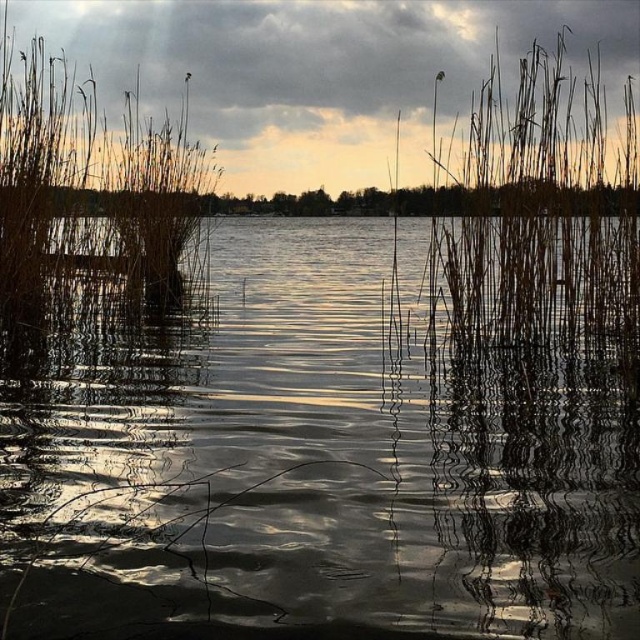
Identify the location of glistening water at center. (316, 464).

This screenshot has width=640, height=640. Find the location of `glistening water at center`. glistening water at center is located at coordinates (316, 464).

This screenshot has height=640, width=640. I want to click on glistening water at center, so click(x=316, y=464).

Is point (115, 49) positioned in front of point (42, 54)?

That is False.

Who is more distant from viewer, [108,52] or [193,157]?

Point [108,52]

Locate an element on the screen. cloudy sky at upper center is located at coordinates (317, 72).

Is glistening water at center taller than brown dry reed at right?

Yes.

Does point (564, 579) lie in front of point (586, 140)?

Yes, point (564, 579) is closer to viewer.

This screenshot has height=640, width=640. In order to click on glistening water at center in this screenshot , I will do `click(316, 464)`.